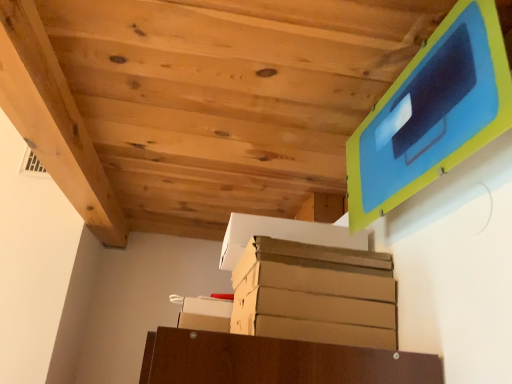
Question: Considering their positions, is brown cardboard box at center, which is the first cardboard box from top to bottom, located in front of or behind white cardboard box at lower center, acting as the 1th cardboard box starting from the left?

Choices:
 (A) front
 (B) behind

Answer: (A)

Question: From a real-world perspective, is brown cardboard box at center, which is counted as the first cardboard box, starting from the right, positioned above or below white cardboard box at lower center, which appears as the 1th cardboard box when ordered from the bottom?

Choices:
 (A) below
 (B) above

Answer: (B)

Question: Visually, is brown cardboard box at center, which is counted as the first cardboard box, starting from the right, positioned to the left or to the right of white cardboard box at lower center, which appears as the 1th cardboard box when ordered from the bottom?

Choices:
 (A) left
 (B) right

Answer: (B)

Question: From a real-world perspective, is white cardboard box at lower center, which appears as the 1th cardboard box when ordered from the bottom, physically located above or below brown cardboard box at center, which ranks as the second cardboard box in bottom-to-top order?

Choices:
 (A) above
 (B) below

Answer: (B)

Question: Relative to brown cardboard box at center, which is the first cardboard box from top to bottom, is white cardboard box at lower center, placed as the 2th cardboard box when sorted from top to bottom, in front or behind?

Choices:
 (A) front
 (B) behind

Answer: (B)

Question: In terms of height, does white cardboard box at lower center, placed as the 2th cardboard box when sorted from top to bottom, look taller or shorter compared to brown cardboard box at center, arranged as the second cardboard box when viewed from the left?

Choices:
 (A) tall
 (B) short

Answer: (B)

Question: Do you think white cardboard box at lower center, acting as the 1th cardboard box starting from the left, is within brown cardboard box at center, arranged as the second cardboard box when viewed from the left, or outside of it?

Choices:
 (A) inside
 (B) outside

Answer: (B)